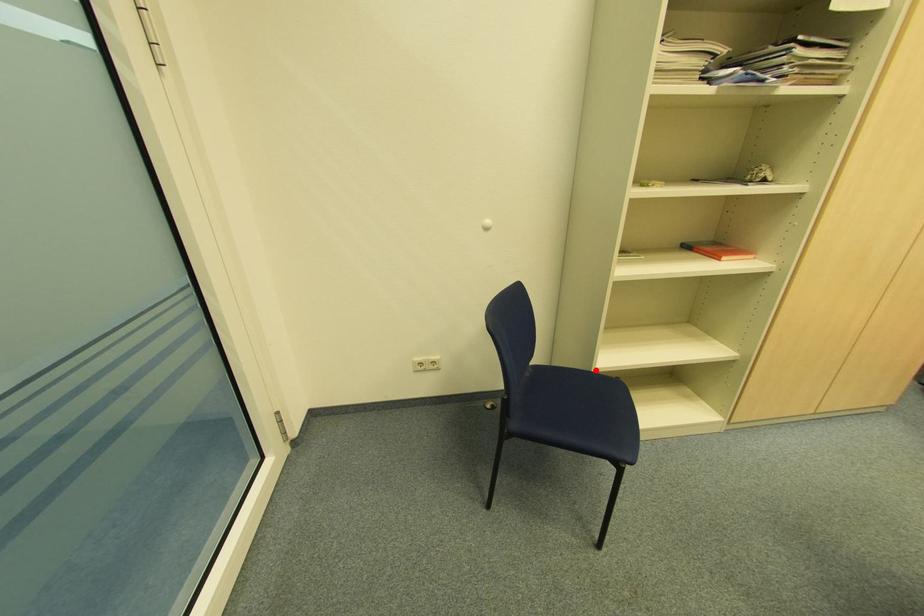
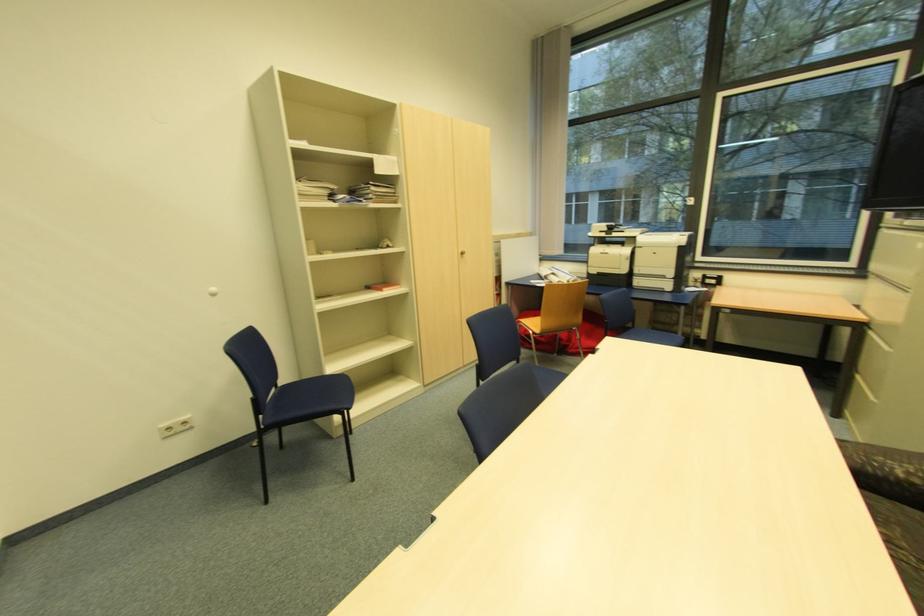
Question: I am providing you with two images of the same scene from different viewpoints. Given a red point in image1, look at the same physical point in image2. Is it:

Choices:
 (A) Closer to the viewpoint
 (B) Farther from the viewpoint

Answer: (A)